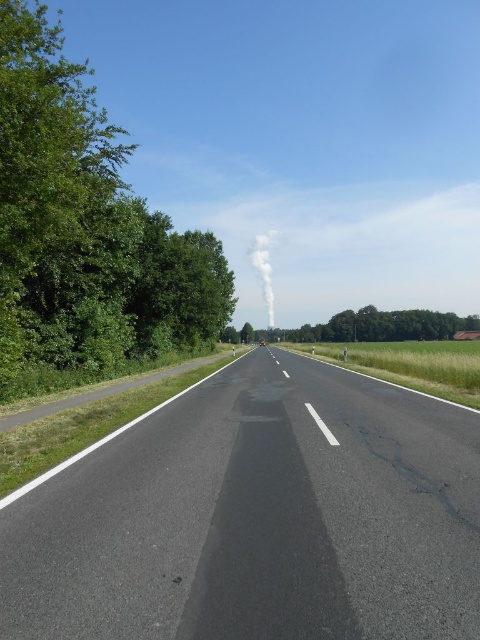
You are driving a car and see the green leafy tree at left and the white smoke at center in the distance. Which one is closer to you?

The green leafy tree at left is closer to you because it is in front of the white smoke at center.

Consider the image. You are a delivery drone flying at an altitude of 3 meters above the black asphalt road at center. You need to land on the road. Is your current altitude sufficient to safely descend and land?

The distance between the black asphalt road at center and the camera is 3.38 meters. Since the drone is flying at 3 meters altitude, it is slightly lower than the required distance. To safely land, the drone should adjust its altitude to match or exceed the 3.38 meters distance to ensure a smooth descent without collision.

You are a pedestrian standing at the edge of the road. You see the black asphalt road at center and the green leafy tree at left. Which object is closer to your right side?

The black asphalt road at center is to the right of the green leafy tree at left, so the black asphalt road at center is closer to your right side.